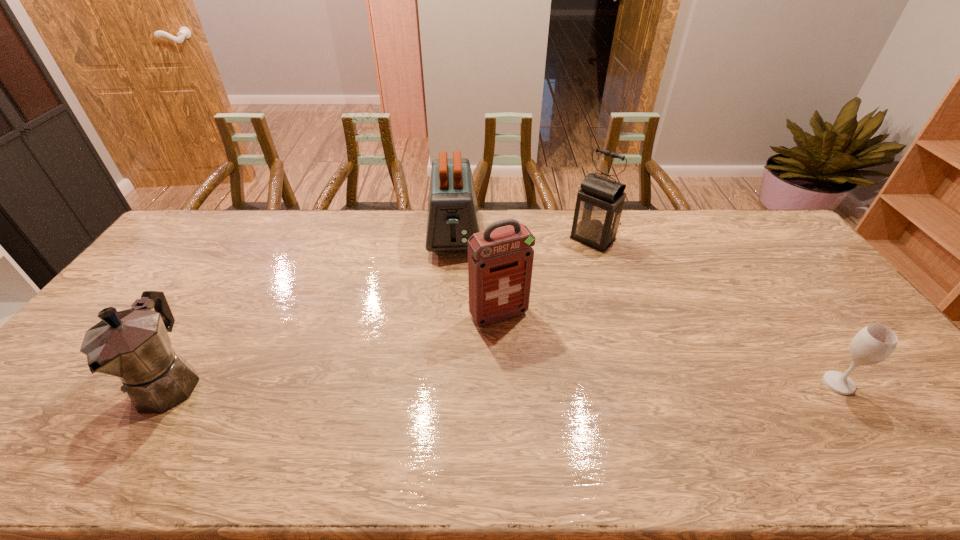
What are the coordinates of `vacant space that satisfies the following two spatial constraints: 1. on the pouring side of the leftmost object; 2. on the left side of the wineglass` in the screenshot? It's located at (169, 383).

You are a GUI agent. You are given a task and a screenshot of the screen. Output one action in this format:
    pyautogui.click(x=<x>, y=<y>)
    Task: Click on the free space that satisfies the following two spatial constraints: 1. on the front side of the second object from right to left; 2. on the right side of the toaster
    
    Given the screenshot: What is the action you would take?
    pyautogui.click(x=453, y=239)

This screenshot has height=540, width=960. Identify the location of blank area in the image that satisfies the following two spatial constraints: 1. on the front side of the shortest object; 2. on the right side of the first-aid kit. (502, 383).

Find the location of a particular element. The image size is (960, 540). vacant space that satisfies the following two spatial constraints: 1. on the front side of the lantern; 2. on the left side of the rightmost object is located at coordinates 638,383.